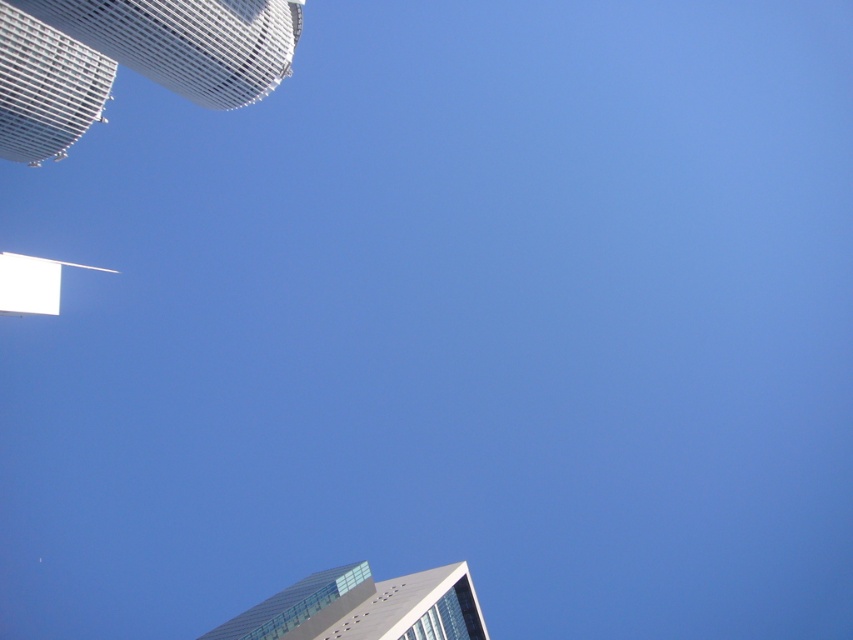
Is white mesh tower at upper left shorter than glassy steel skyscraper at lower center?

No, white mesh tower at upper left is not shorter than glassy steel skyscraper at lower center.

Can you confirm if white mesh tower at upper left is thinner than glassy steel skyscraper at lower center?

In fact, white mesh tower at upper left might be wider than glassy steel skyscraper at lower center.

Does point (293, 49) lie in front of point (415, 604)?

No, (293, 49) is further to viewer.

At what (x,y) coordinates should I click in order to perform the action: click on white mesh tower at upper left. Please return your answer as a coordinate pair (x, y). The image size is (853, 640). Looking at the image, I should click on (131, 60).